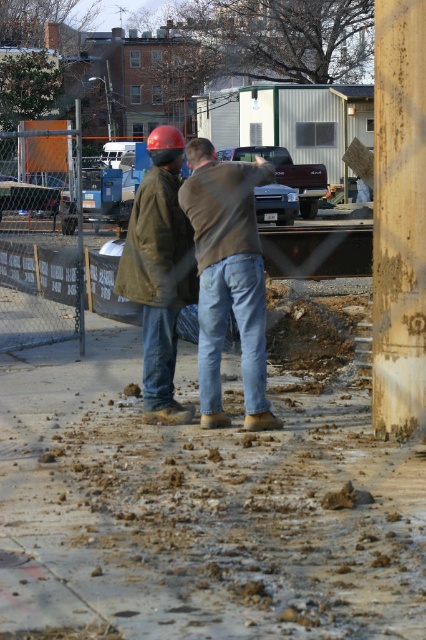
You are a construction worker standing at the edge of the construction site. You need to walk to the muddy concrete at center. Which direction should you head from your current position?

The muddy concrete at center is located at point (198, 508), so you should head towards the center of the image to reach it.

You are a construction worker standing on the muddy concrete at center. You need to place a heavy tool on the ground near the matte brown jacket at center. Where should you put it so that it stays stable?

The muddy concrete at center is positioned under the matte brown jacket at center, so placing the tool on the muddy concrete at center will ensure stability.